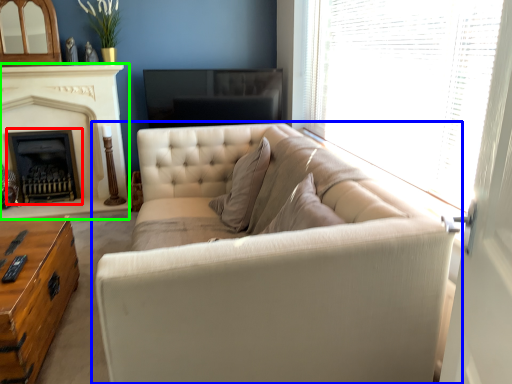
Question: Based on their relative distances, which object is farther from fireplace (highlighted by a red box)? Choose from studio couch (highlighted by a blue box) and fireplace (highlighted by a green box).

Choices:
 (A) studio couch
 (B) fireplace

Answer: (A)